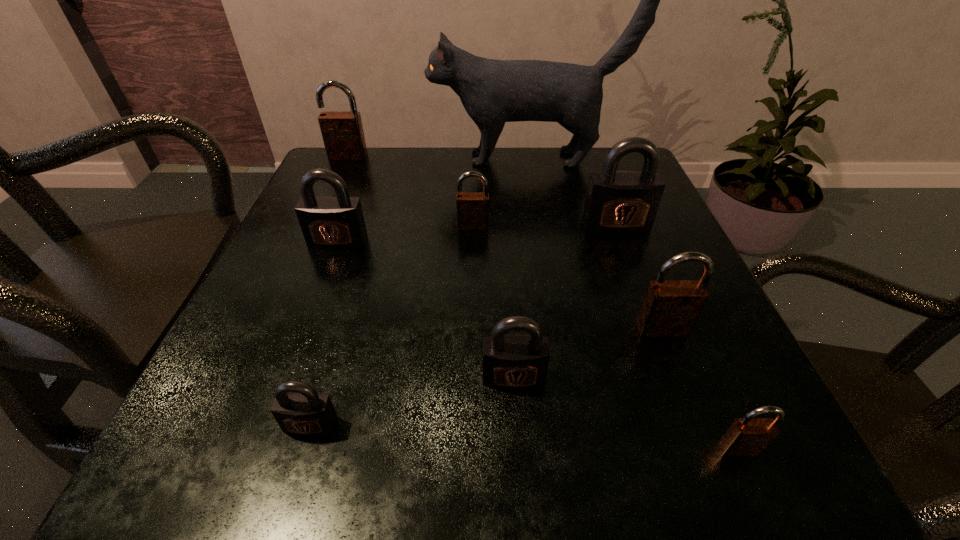
This screenshot has height=540, width=960. I want to click on the third biggest gray padlock, so click(x=510, y=361).

Where is `the sixth farthest padlock`? the sixth farthest padlock is located at coordinates (510, 361).

You are a GUI agent. You are given a task and a screenshot of the screen. Output one action in this format:
    pyautogui.click(x=<x>, y=<y>)
    Task: Click on the seventh farthest padlock
    This screenshot has width=960, height=540.
    Given the screenshot: What is the action you would take?
    pyautogui.click(x=303, y=411)

Image resolution: width=960 pixels, height=540 pixels. Find the location of `the nearest gray padlock`. the nearest gray padlock is located at coordinates (303, 411).

Where is `the smallest brown padlock`? This screenshot has width=960, height=540. the smallest brown padlock is located at coordinates (748, 436).

Find the location of `the nearest object`. the nearest object is located at coordinates (748, 436).

The width and height of the screenshot is (960, 540). In order to click on blank space located at the face of the gray cat in this screenshot , I will do `click(331, 159)`.

Identify the location of free space located at the face of the gray cat. (377, 159).

Where is `vacant space located 0.110m at the face of the gray cat`? The width and height of the screenshot is (960, 540). vacant space located 0.110m at the face of the gray cat is located at coordinates (385, 159).

Where is `free space located 0.260m on the front of the biggest gray padlock near the keyhole`? This screenshot has width=960, height=540. free space located 0.260m on the front of the biggest gray padlock near the keyhole is located at coordinates (660, 343).